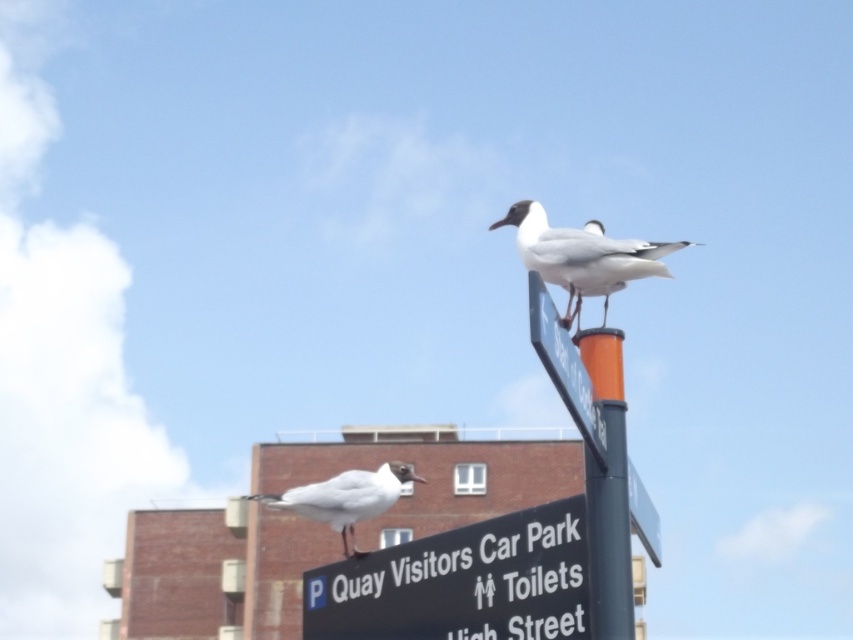
You are standing in front of the signpost with two seagulls. There is a point marked at coordinates (461,582). What object does this point correspond to?

The point corresponds to the black plastic sign at lower center.